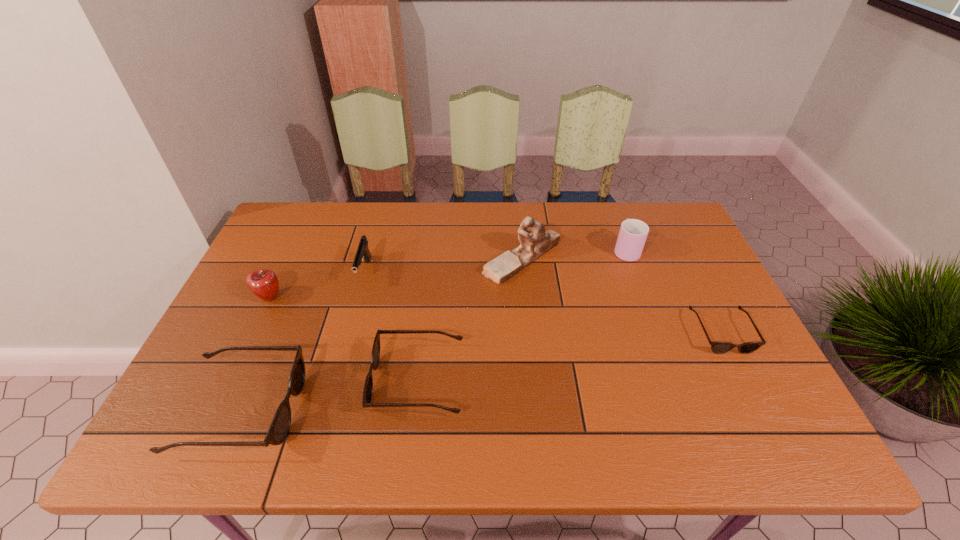
Find the location of `vacant point located between the leftmost sunglasses and the second object from right to left`. vacant point located between the leftmost sunglasses and the second object from right to left is located at coordinates (434, 329).

Where is `object that stands as the second closest to the sixth tallest object`? This screenshot has width=960, height=540. object that stands as the second closest to the sixth tallest object is located at coordinates (363, 252).

Locate which object ranks sixth in proximity to the apple. Please provide its 2D coordinates. Your answer should be formatted as a tuple, i.e. [(x, y)], where the tuple contains the x and y coordinates of a point satisfying the conditions above.

[(717, 347)]

At what (x,y) coordinates should I click in order to perform the action: click on sunglasses that is the second closest to the cup. Please return your answer as a coordinate pair (x, y). This screenshot has width=960, height=540. Looking at the image, I should click on 375,355.

Locate which sunglasses ranks in proximity to the third object from left to right. Please provide its 2D coordinates. Your answer should be formatted as a tuple, i.e. [(x, y)], where the tuple contains the x and y coordinates of a point satisfying the conditions above.

[(375, 355)]

Find the location of a particular element. vacant space that satisfies the following two spatial constraints: 1. on the front-facing side of the figurine; 2. at the muzzle of the pistol is located at coordinates (523, 272).